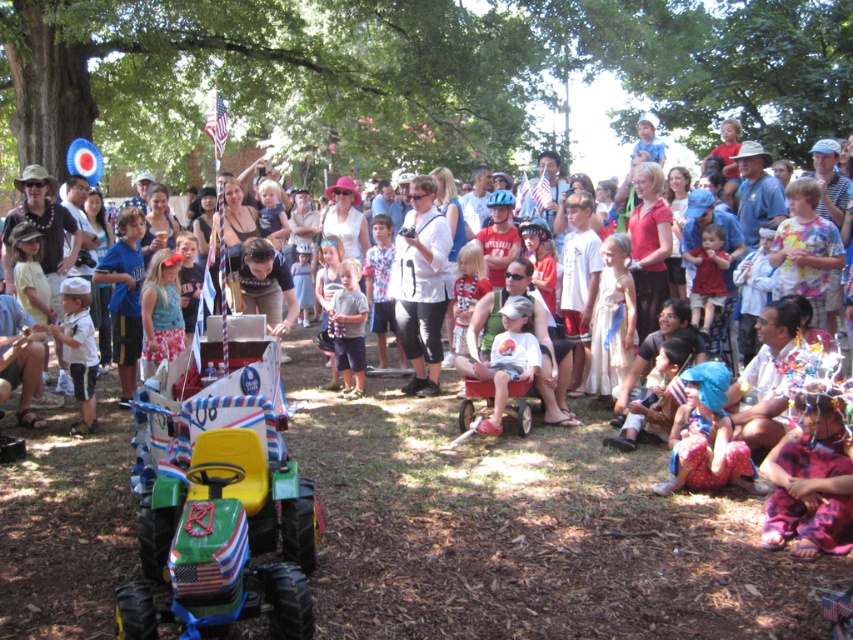
Question: Which point is farther from the camera taking this photo?

Choices:
 (A) (477, 364)
 (B) (73, 310)
 (C) (360, 371)
 (D) (291, 536)

Answer: (C)

Question: Which point appears farthest from the camera in this image?

Choices:
 (A) (80, 317)
 (B) (705, 461)

Answer: (A)

Question: Does white matte shirt at center have a greater width compared to light blue denim shorts at center?

Choices:
 (A) yes
 (B) no

Answer: (A)

Question: Is blue fabric hat at lower right thinner than white matte shirt at left?

Choices:
 (A) no
 (B) yes

Answer: (A)

Question: Can you confirm if white matte shirt at left is positioned below red cotton shirt at lower right?

Choices:
 (A) no
 (B) yes

Answer: (B)

Question: Based on their relative distances, which object is farther from the white matte shirt at center?

Choices:
 (A) light blue denim shorts at center
 (B) red cotton shirt at lower right
 (C) green plastic toy car at center
 (D) blue fabric hat at lower right

Answer: (C)